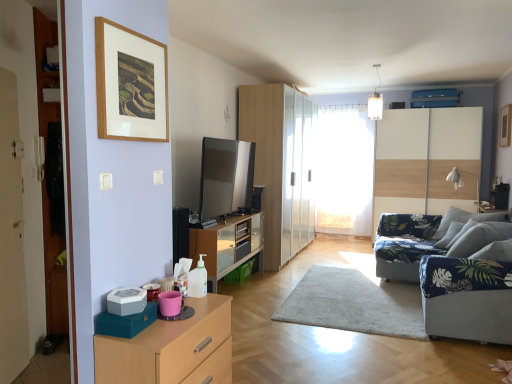
Question: From a real-world perspective, is blue fabric armchair at right above or below transparent glass wardrobe at center?

Choices:
 (A) below
 (B) above

Answer: (A)

Question: Relative to transparent glass wardrobe at center, is blue fabric armchair at right in front or behind?

Choices:
 (A) behind
 (B) front

Answer: (B)

Question: Considering the real-world distances, which object is farthest from the white sheer curtain at center?

Choices:
 (A) matte wood dresser at center, the 2th dresser from the right
 (B) light wood/wooden chest of drawers at lower left
 (C) gray plastic pet food container at lower left, the 2th appliance from the back
 (D) transparent glass wardrobe at center
 (E) satin silver tv at center, the 1th appliance in the top-to-bottom sequence

Answer: (C)

Question: Estimate the real-world distances between objects in this image. Which object is closer to the white glossy dresser at right, which is the second dresser in left-to-right order?

Choices:
 (A) gray plastic pet food container at lower left, the 1th appliance in the left-to-right sequence
 (B) blue fabric armchair at right
 (C) satin silver tv at center, the 2th appliance positioned from the bottom
 (D) blue fabric couch at right
 (E) white sheer curtain at center

Answer: (E)